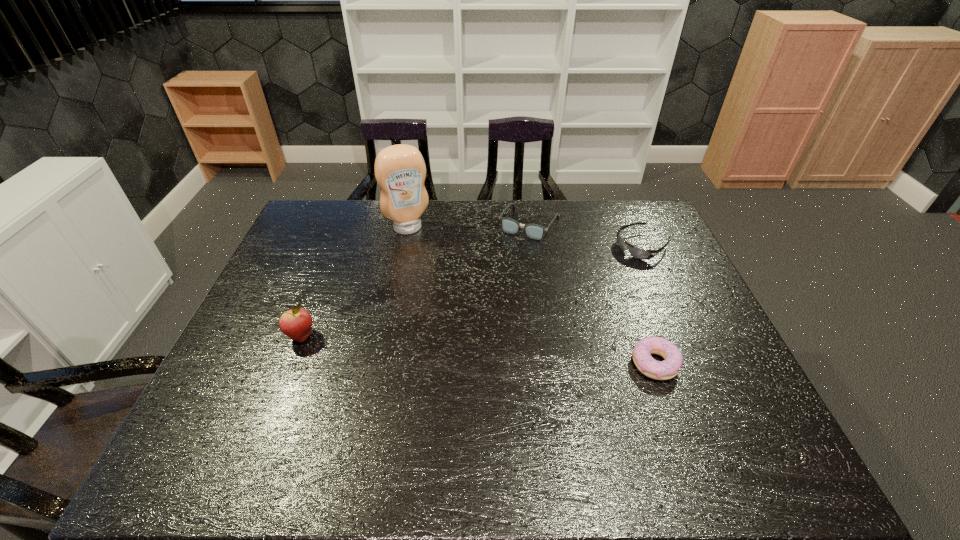
I want to click on free space on the desktop that is between the second tallest object and the doughnut and is positioned on the face of the third tallest object, so click(x=456, y=348).

The image size is (960, 540). Find the location of `free spot on the desktop that is between the second tallest object and the doughnut and is positioned on the label of the tallest object`. free spot on the desktop that is between the second tallest object and the doughnut and is positioned on the label of the tallest object is located at coordinates (463, 348).

What are the coordinates of `free spot on the desktop that is between the leftmost object and the doughnut and is positioned on the lenses of the sunglasses` in the screenshot? It's located at (487, 350).